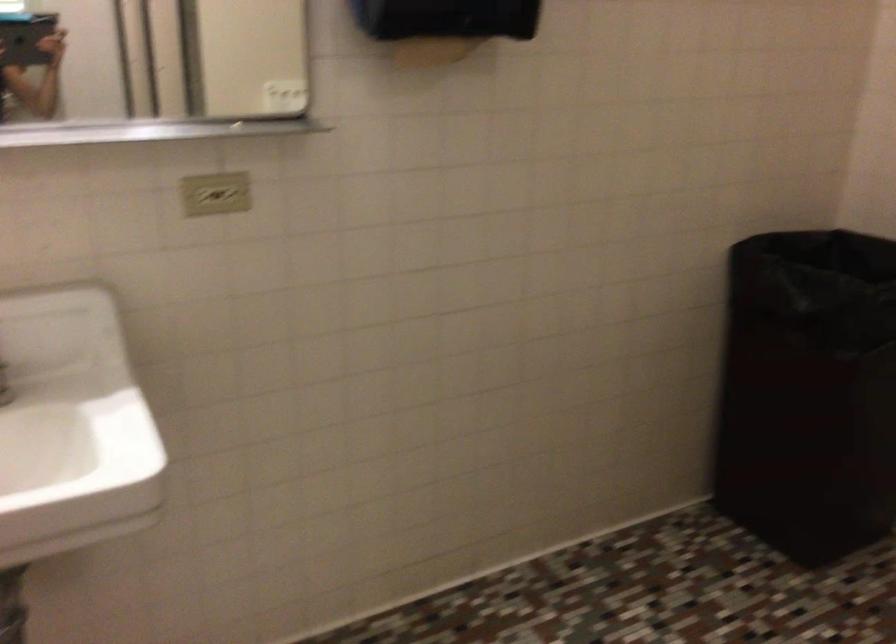
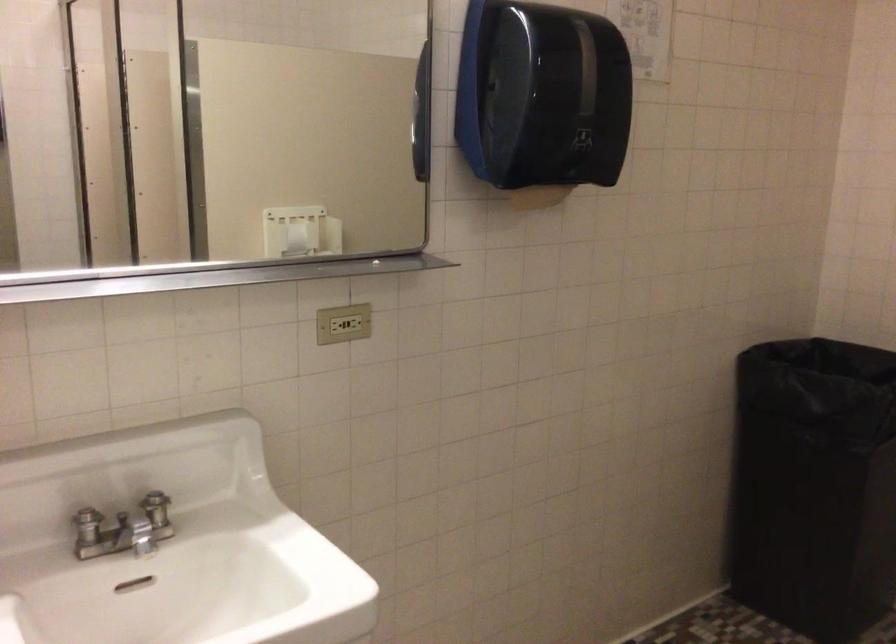
Question: The camera is either moving clockwise (left) or counter-clockwise (right) around the object. The first image is from the beginning of the video and the second image is from the end. Is the camera moving left or right when shooting the video?

Choices:
 (A) Left
 (B) Right

Answer: (A)